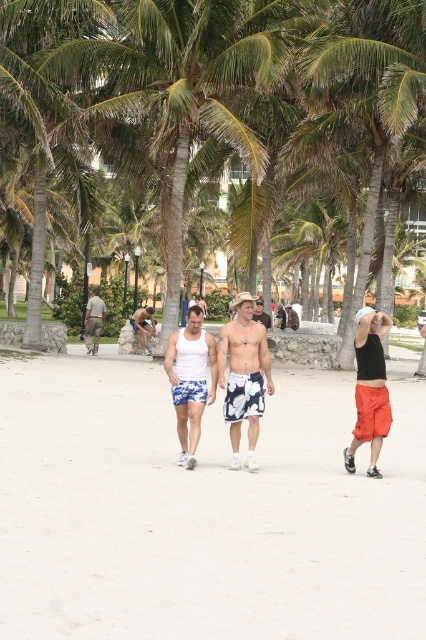
Who is higher up, white floral boardshorts at center or floral shorts at center?

Positioned higher is floral shorts at center.

In the scene shown: Does white floral boardshorts at center have a larger size compared to floral shorts at center?

Correct, white floral boardshorts at center is larger in size than floral shorts at center.

Does point (232, 362) come behind point (296, 317)?

No, it is not.

Find the location of `white floral boardshorts at center`. white floral boardshorts at center is located at coordinates (244, 376).

Between white floral shorts at center and floral shorts at center, which one is positioned lower?

white floral shorts at center is lower down.

Locate an element on the screen. This screenshot has height=640, width=426. white floral shorts at center is located at coordinates point(203,512).

Measure the distance between white floral shorts at center and camera.

4.99 meters

In order to click on white floral shorts at center in this screenshot , I will do `click(203, 512)`.

Which is in front, point (229, 122) or point (250, 404)?

Point (250, 404) is more forward.

Image resolution: width=426 pixels, height=640 pixels. Describe the element at coordinates (215, 68) in the screenshot. I see `green leafy palm tree at center` at that location.

You are a GUI agent. You are given a task and a screenshot of the screen. Output one action in this format:
    pyautogui.click(x=<x>, y=<y>)
    Task: Click on the green leafy palm tree at center
    
    Given the screenshot: What is the action you would take?
    (x=215, y=68)